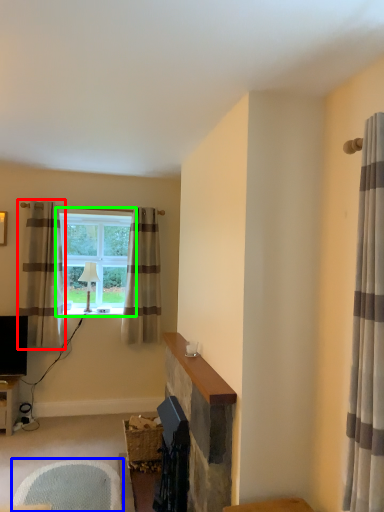
Question: Estimate the real-world distances between objects in this image. Which object is closer to curtain (highlighted by a red box), swivel chair (highlighted by a blue box) or window (highlighted by a green box)?

Choices:
 (A) swivel chair
 (B) window

Answer: (B)